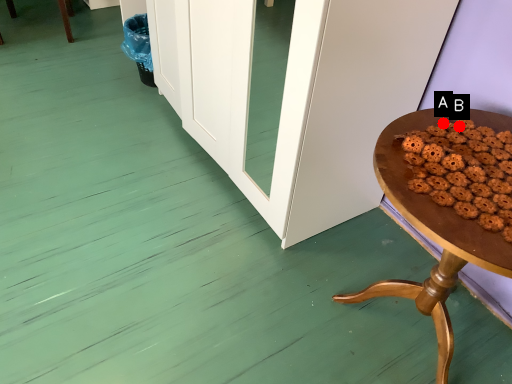
Question: Two points are circled on the image, labeled by A and B beside each circle. Which point is further to the camera?

Choices:
 (A) A is further
 (B) B is further

Answer: (A)